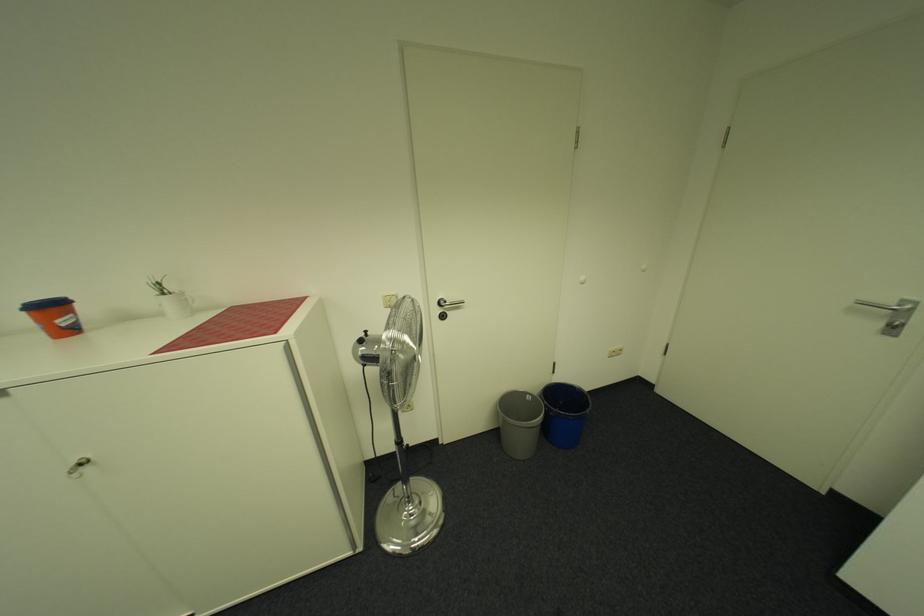
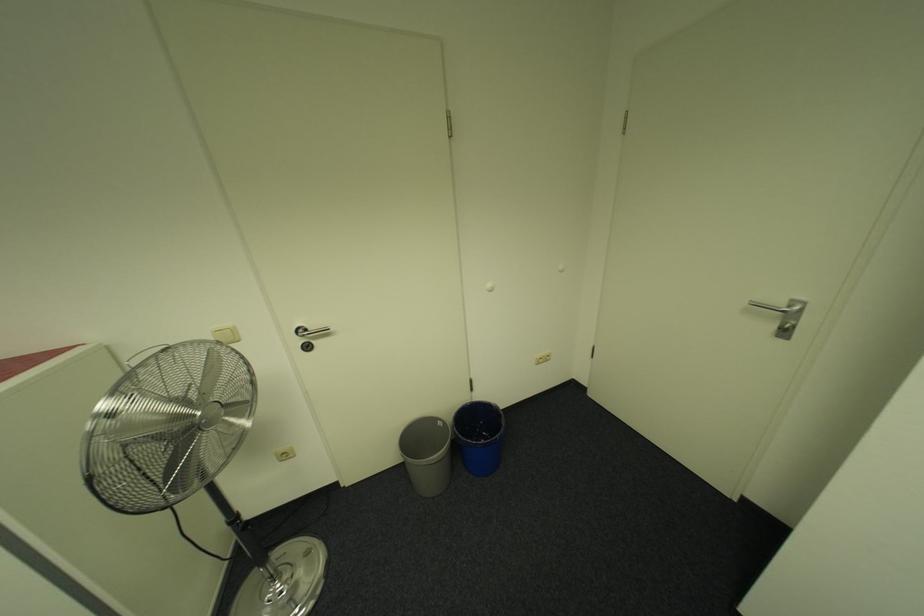
Question: The camera is either moving clockwise (left) or counter-clockwise (right) around the object. The first image is from the beginning of the video and the second image is from the end. Is the camera moving left or right when shooting the video?

Choices:
 (A) Left
 (B) Right

Answer: (A)